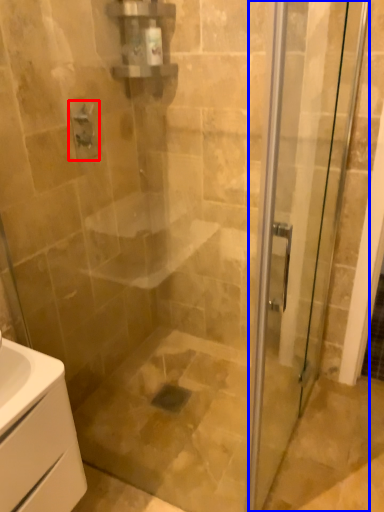
Question: Which point is further to the camera, shower (highlighted by a red box) or door (highlighted by a blue box)?

Choices:
 (A) shower
 (B) door

Answer: (A)